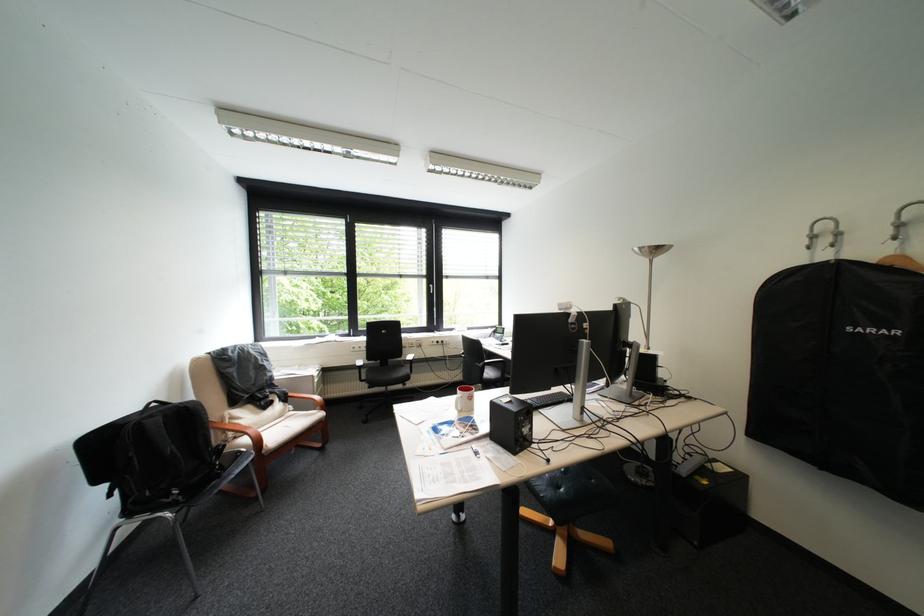
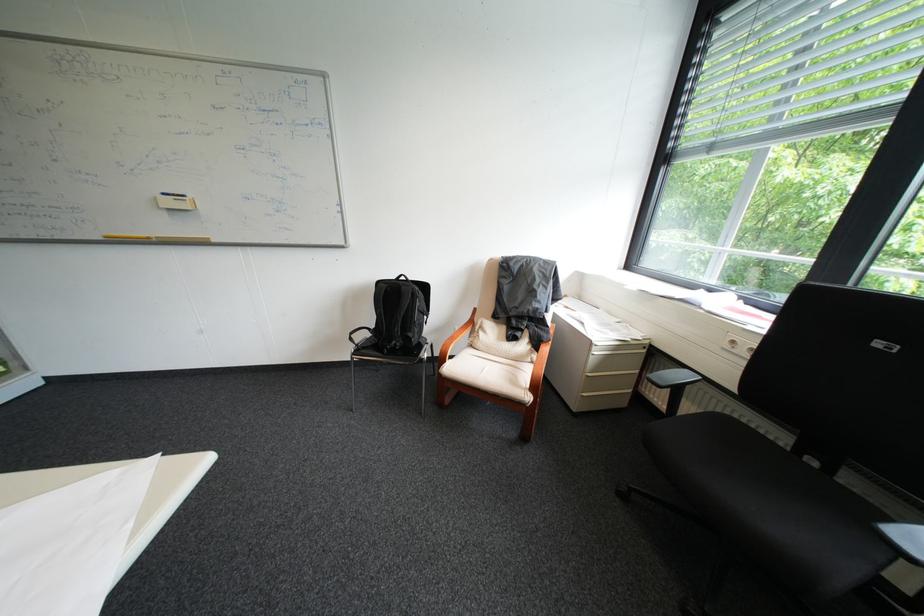
In the second image, find the point that corresponds to (x=366, y=349) in the first image.

(746, 342)